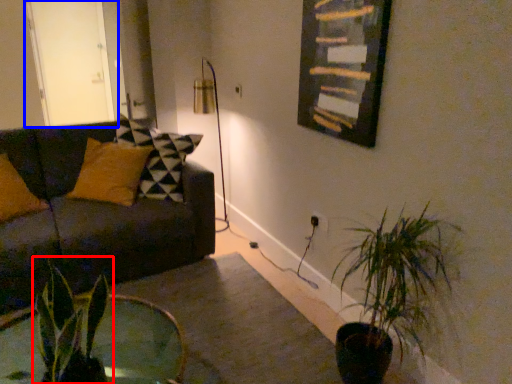
Question: Among these objects, which one is farthest to the camera, houseplant (highlighted by a red box) or glass door (highlighted by a blue box)?

Choices:
 (A) houseplant
 (B) glass door

Answer: (B)